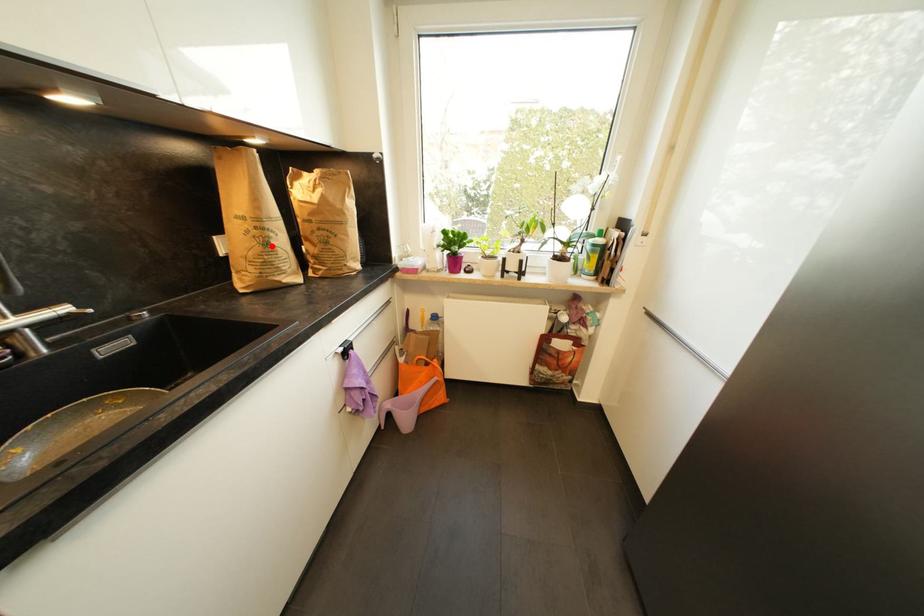
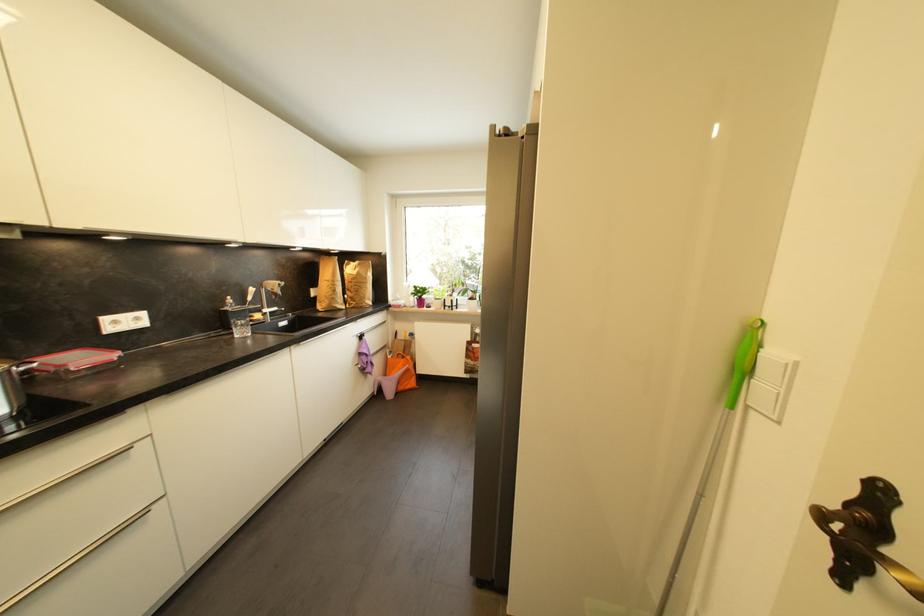
The point at the highlighted location is marked in the first image. Where is the corresponding point in the second image?

(339, 293)